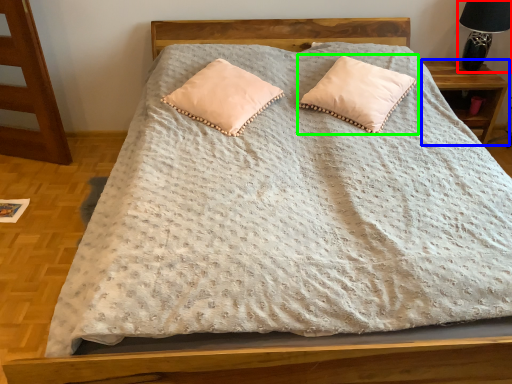
Question: Which is farther away from table lamp (highlighted by a red box)? nightstand (highlighted by a blue box) or pillow (highlighted by a green box)?

Choices:
 (A) nightstand
 (B) pillow

Answer: (B)